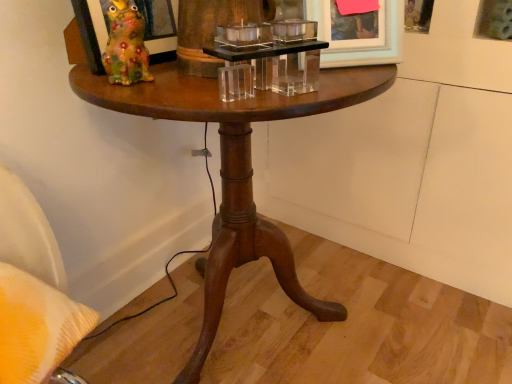
Question: Is matte white picture frame at upper right, which is counted as the second picture frame, starting from the left, positioned far away from clear acrylic candle holder at center?

Choices:
 (A) no
 (B) yes

Answer: (A)

Question: Can you confirm if matte white picture frame at upper right, the 2th picture frame in the right-to-left sequence, is bigger than clear acrylic candle holder at center?

Choices:
 (A) no
 (B) yes

Answer: (B)

Question: Is matte white picture frame at upper right, which is counted as the second picture frame, starting from the left, to the right of clear acrylic candle holder at center from the viewer's perspective?

Choices:
 (A) yes
 (B) no

Answer: (A)

Question: Does matte white picture frame at upper right, the 2th picture frame in the right-to-left sequence, lie in front of clear acrylic candle holder at center?

Choices:
 (A) no
 (B) yes

Answer: (A)

Question: Considering the relative sizes of matte white picture frame at upper right, which is counted as the second picture frame, starting from the left, and clear acrylic candle holder at center in the image provided, is matte white picture frame at upper right, which is counted as the second picture frame, starting from the left, smaller than clear acrylic candle holder at center?

Choices:
 (A) yes
 (B) no

Answer: (B)

Question: Is the surface of matte white picture frame at upper right, the 2th picture frame in the right-to-left sequence, in direct contact with clear acrylic candle holder at center?

Choices:
 (A) yes
 (B) no

Answer: (A)

Question: Considering the relative positions of matte ceramic frog at upper left, which is the 1th picture frame in left-to-right order, and clear acrylic candle holder at center in the image provided, is matte ceramic frog at upper left, which is the 1th picture frame in left-to-right order, to the right of clear acrylic candle holder at center from the viewer's perspective?

Choices:
 (A) no
 (B) yes

Answer: (A)

Question: Would you say matte ceramic frog at upper left, the third picture frame when ordered from right to left, contains clear acrylic candle holder at center?

Choices:
 (A) yes
 (B) no

Answer: (B)

Question: From a real-world perspective, is matte ceramic frog at upper left, the third picture frame when ordered from right to left, positioned under clear acrylic candle holder at center based on gravity?

Choices:
 (A) yes
 (B) no

Answer: (B)

Question: Is matte ceramic frog at upper left, which is the 1th picture frame in left-to-right order, oriented towards clear acrylic candle holder at center?

Choices:
 (A) no
 (B) yes

Answer: (B)

Question: From a real-world perspective, is matte ceramic frog at upper left, which is the 1th picture frame in left-to-right order, positioned over clear acrylic candle holder at center based on gravity?

Choices:
 (A) no
 (B) yes

Answer: (B)

Question: Can you confirm if matte ceramic frog at upper left, the third picture frame when ordered from right to left, is wider than clear acrylic candle holder at center?

Choices:
 (A) no
 (B) yes

Answer: (A)

Question: Would you say wooden picture frame at upper right, the first picture frame when ordered from right to left, is a long distance from matte ceramic frog at upper left, the third picture frame when ordered from right to left?

Choices:
 (A) no
 (B) yes

Answer: (A)